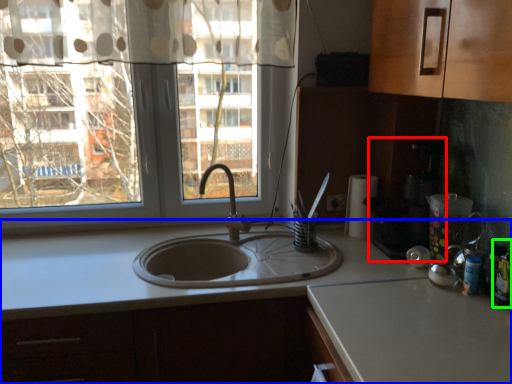
Question: Based on their relative distances, which object is farther from coffee machine (highlighted by a red box)? Choose from countertop (highlighted by a blue box) and bottle (highlighted by a green box).

Choices:
 (A) countertop
 (B) bottle

Answer: (A)